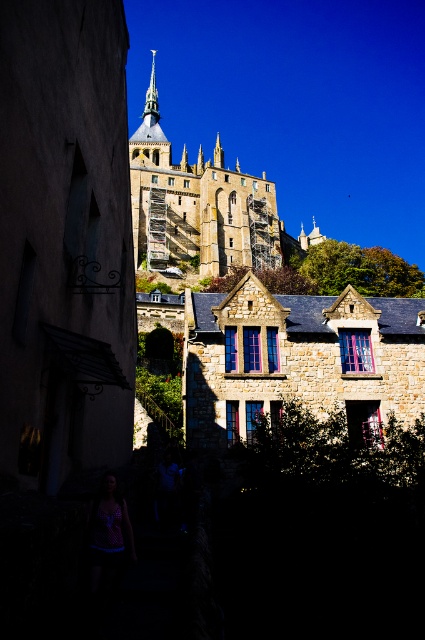
Is stone medieval castle at upper center smaller than smooth gold spire at upper center?

Incorrect, stone medieval castle at upper center is not smaller in size than smooth gold spire at upper center.

Between stone medieval castle at upper center and smooth gold spire at upper center, which one has less height?

With less height is smooth gold spire at upper center.

Is point (223, 268) in front of point (146, 100)?

Yes, point (223, 268) is closer to viewer.

Find the location of a particular element. Image resolution: width=425 pixels, height=640 pixels. stone medieval castle at upper center is located at coordinates (203, 211).

Does stone textured house at center appear over smooth gold spire at upper center?

No, stone textured house at center is not above smooth gold spire at upper center.

Is point (317, 364) closer to viewer compared to point (153, 58)?

Yes, point (317, 364) is closer to viewer.

Which is behind, point (246, 300) or point (144, 115)?

Positioned behind is point (144, 115).

Find the location of a particular element. stone textured house at center is located at coordinates (297, 362).

The width and height of the screenshot is (425, 640). What do you see at coordinates (297, 362) in the screenshot? I see `stone textured house at center` at bounding box center [297, 362].

Does stone textured house at center have a lesser width compared to stone medieval castle at upper center?

Yes, stone textured house at center is thinner than stone medieval castle at upper center.

Is point (297, 317) closer to viewer compared to point (147, 257)?

Yes, point (297, 317) is closer to viewer.

Locate an element on the screen. stone textured house at center is located at coordinates (297, 362).